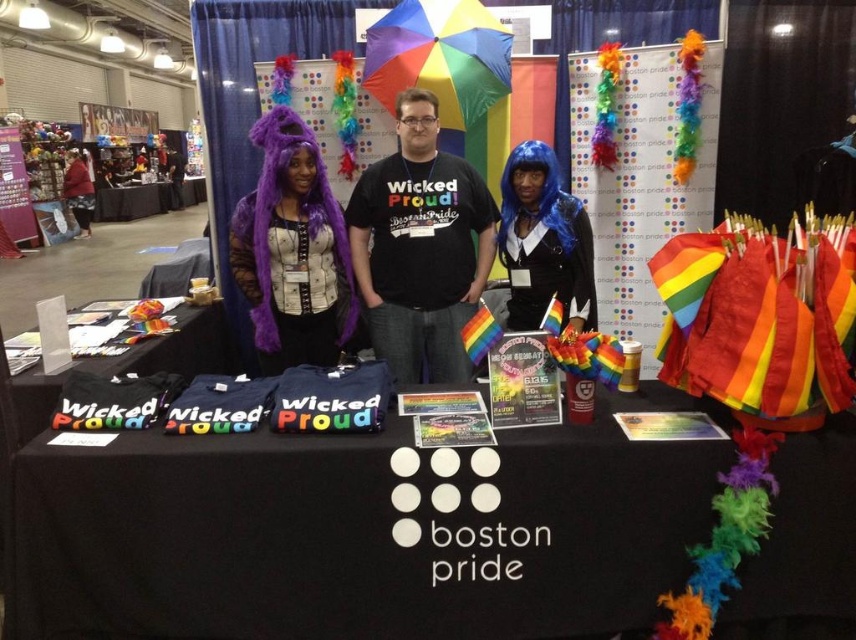
Who is positioned more to the left, black t-shirt at center or purple furry wig at upper left?

Positioned to the left is purple furry wig at upper left.

Which of these two, black t-shirt at center or purple furry wig at upper left, stands taller?

With more height is black t-shirt at center.

Find the location of `black t-shirt at center`. black t-shirt at center is located at coordinates tap(420, 248).

Who is more distant from viewer, [376,275] or [492,228]?

→ The point [492,228] is behind.

Who is positioned more to the right, purple fuzzy wig at center or black t-shirt at center?

black t-shirt at center is more to the right.

Between point (397, 211) and point (471, 196), which one is positioned in front?

Point (397, 211) is more forward.

Locate an element on the screen. purple fuzzy wig at center is located at coordinates tap(420, 248).

Is point (597, 474) closer to camera compared to point (515, 301)?

Yes, it is.

Between black fabric table at center and blue matte wig at center, which one has more height?

blue matte wig at center

Does point (464, 506) come farther from viewer compared to point (538, 177)?

No, (464, 506) is in front of (538, 177).

Where is `black fabric table at center`? This screenshot has height=640, width=856. black fabric table at center is located at coordinates [x=360, y=532].